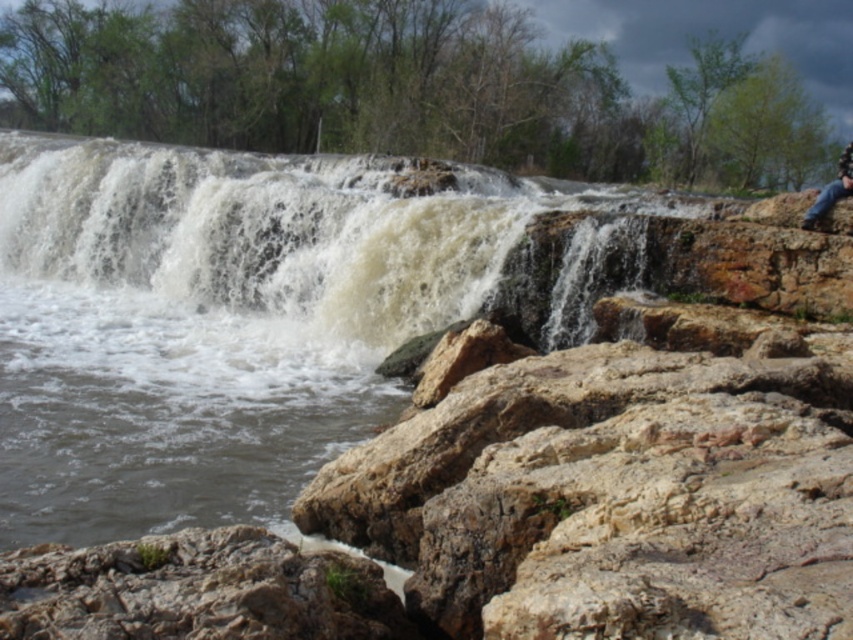
Question: Observing the image, what is the correct spatial positioning of white frothy water at center in reference to jeans at right?

Choices:
 (A) left
 (B) right

Answer: (A)

Question: Does white frothy water at center have a greater width compared to jeans at right?

Choices:
 (A) no
 (B) yes

Answer: (B)

Question: Which point is farther to the camera?

Choices:
 (A) (850, 157)
 (B) (73, 275)

Answer: (B)

Question: Is white frothy water at center positioned in front of jeans at right?

Choices:
 (A) yes
 (B) no

Answer: (A)

Question: Among these points, which one is nearest to the camera?

Choices:
 (A) (212, 164)
 (B) (811, 216)

Answer: (B)